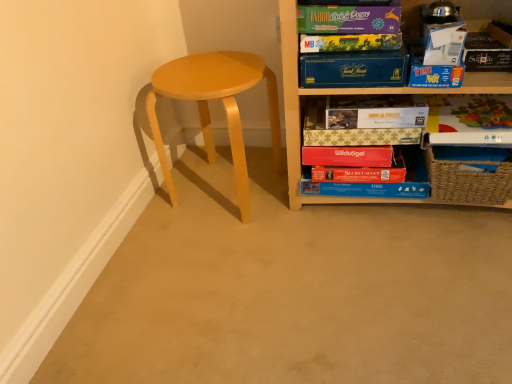
Locate an element on the screen. This screenshot has width=512, height=384. free space above blue cardboard box at upper center, acting as the third paperback book starting from the top (from a real-world perspective) is located at coordinates (357, 45).